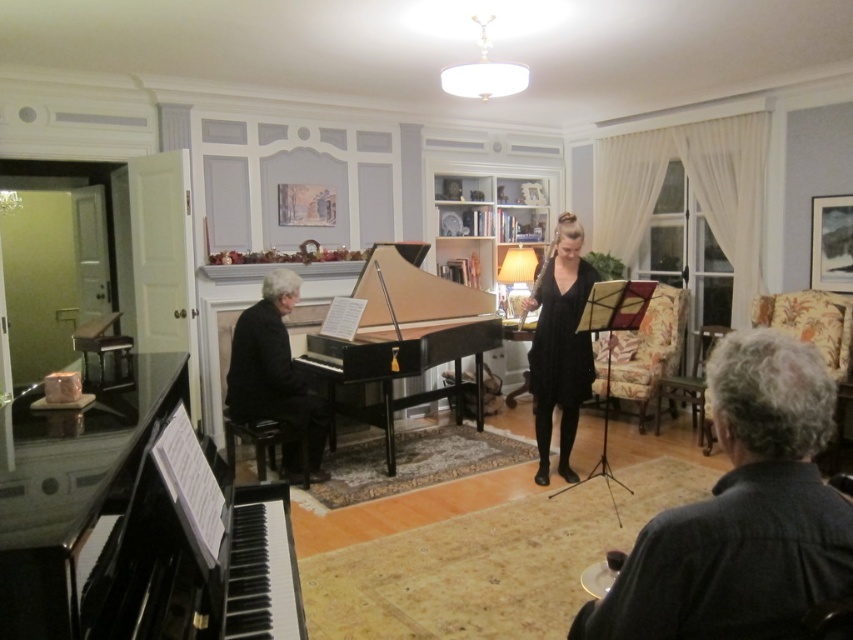
You are a stagehand preparing for a performance. You need to ensure there is enough space between the black polished wood grand piano at center and the black satin dress at center for a 1 meter wide curtain to pass through. Is there sufficient space?

The distance between the black polished wood grand piano at center and the black satin dress at center is 1.01 meters, which is just enough to allow a 1 meter wide curtain to pass through.

You are a stagehand setting up for a concert. You need to place a 1.2 meter tall amplifier between the black polished wood grand piano at center and the black glossy piano at center. Can the amplifier fit vertically between them?

The black polished wood grand piano at center is taller than the black glossy piano at center. Since the amplifier is 1.2 meters tall, it can fit vertically between them as long as the space between the two pianos allows for its placement. However, the exact vertical clearance depends on the height difference between the two pianos, which isn t specified. The question can t be definitively answered with the given information.

You are a photographer setting up for a photoshoot in this room. You need to decide whether to place a large lighting setup near the black polished wood grand piano at center or the black satin dress at center. Based on their sizes, which object would be more suitable for positioning the lighting setup next to?

The black polished wood grand piano at center is larger in size than the black satin dress at center, so it would be more suitable to place the large lighting setup next to the black polished wood grand piano at center.